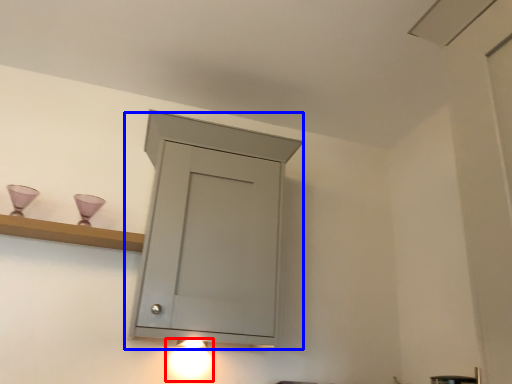
Question: Which of the following is the farthest to the observer, light fixture (highlighted by a red box) or cupboard (highlighted by a blue box)?

Choices:
 (A) light fixture
 (B) cupboard

Answer: (A)